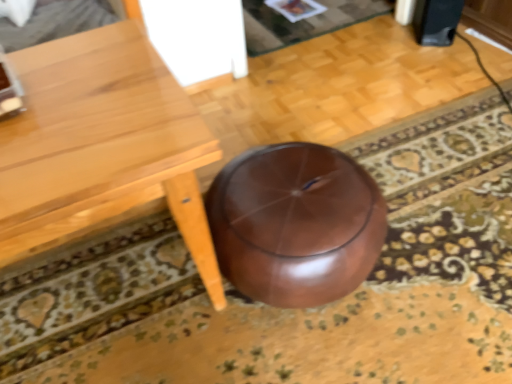
At what (x,y) coordinates should I click in order to perform the action: click on light brown wooden table at lower right. Please return your answer as a coordinate pair (x, y). Looking at the image, I should click on (101, 146).

Describe the element at coordinates (101, 146) in the screenshot. I see `light brown wooden table at lower right` at that location.

Describe the element at coordinates (436, 21) in the screenshot. I see `black matte speaker at upper right` at that location.

The height and width of the screenshot is (384, 512). Find the location of `black matte speaker at upper right`. black matte speaker at upper right is located at coordinates (436, 21).

Where is `light brown wooden table at lower right`? This screenshot has width=512, height=384. light brown wooden table at lower right is located at coordinates (101, 146).

Does black matte speaker at upper right appear on the right side of light brown wooden table at lower right?

Indeed, black matte speaker at upper right is positioned on the right side of light brown wooden table at lower right.

From the picture: Considering the relative positions of black matte speaker at upper right and light brown wooden table at lower right in the image provided, is black matte speaker at upper right behind light brown wooden table at lower right?

Yes, the depth of black matte speaker at upper right is greater than that of light brown wooden table at lower right.

Is point (449, 19) positioned behind point (94, 53)?

Yes, point (449, 19) is farther from viewer.

From the image's perspective, between black matte speaker at upper right and light brown wooden table at lower right, who is located below?

light brown wooden table at lower right is shown below in the image.

From a real-world perspective, which object stands above the other?

In real-world perspective, light brown wooden table at lower right is above.

Between black matte speaker at upper right and light brown wooden table at lower right, which one has larger width?

With larger width is light brown wooden table at lower right.

Who is taller, black matte speaker at upper right or light brown wooden table at lower right?

light brown wooden table at lower right is taller.

Does black matte speaker at upper right have a smaller size compared to light brown wooden table at lower right?

Correct, black matte speaker at upper right occupies less space than light brown wooden table at lower right.

Would you say black matte speaker at upper right is inside or outside light brown wooden table at lower right?

black matte speaker at upper right is spatially situated outside light brown wooden table at lower right.

From the picture: Are black matte speaker at upper right and light brown wooden table at lower right far apart?

Yes.

Is black matte speaker at upper right looking in the opposite direction of light brown wooden table at lower right?

No, light brown wooden table at lower right is not at the back of black matte speaker at upper right.

This screenshot has width=512, height=384. What are the coordinates of `table in front of the black matte speaker at upper right` in the screenshot? It's located at (101, 146).

In the scene shown: Does light brown wooden table at lower right appear on the left side of black matte speaker at upper right?

Indeed, light brown wooden table at lower right is positioned on the left side of black matte speaker at upper right.

Considering their positions, is light brown wooden table at lower right located in front of or behind black matte speaker at upper right?

Visually, light brown wooden table at lower right is located in front of black matte speaker at upper right.

Considering the points (167, 94) and (432, 38), which point is behind, point (167, 94) or point (432, 38)?

The point (432, 38) is farther.

From the image's perspective, is light brown wooden table at lower right below black matte speaker at upper right?

Yes, from the image's perspective, light brown wooden table at lower right is below black matte speaker at upper right.

From a real-world perspective, is light brown wooden table at lower right physically above black matte speaker at upper right?

Yes, from a real-world perspective, light brown wooden table at lower right is on top of black matte speaker at upper right.

Which object is wider, light brown wooden table at lower right or black matte speaker at upper right?

Wider between the two is light brown wooden table at lower right.

Who is taller, light brown wooden table at lower right or black matte speaker at upper right?

With more height is light brown wooden table at lower right.

Between light brown wooden table at lower right and black matte speaker at upper right, which one has larger size?

With larger size is light brown wooden table at lower right.

Is light brown wooden table at lower right positioned beyond the bounds of black matte speaker at upper right?

Yes, light brown wooden table at lower right is outside of black matte speaker at upper right.

In the scene shown: Are light brown wooden table at lower right and black matte speaker at upper right far apart?

Yes.

Is light brown wooden table at lower right positioned with its back to black matte speaker at upper right?

No, light brown wooden table at lower right is not facing the opposite direction of black matte speaker at upper right.

I want to click on speaker behind the light brown wooden table at lower right, so click(436, 21).

At what (x,y) coordinates should I click in order to perform the action: click on table to the left of black matte speaker at upper right. Please return your answer as a coordinate pair (x, y). This screenshot has height=384, width=512. Looking at the image, I should click on (101, 146).

Locate an element on the screen. The image size is (512, 384). table below the black matte speaker at upper right (from the image's perspective) is located at coordinates (101, 146).